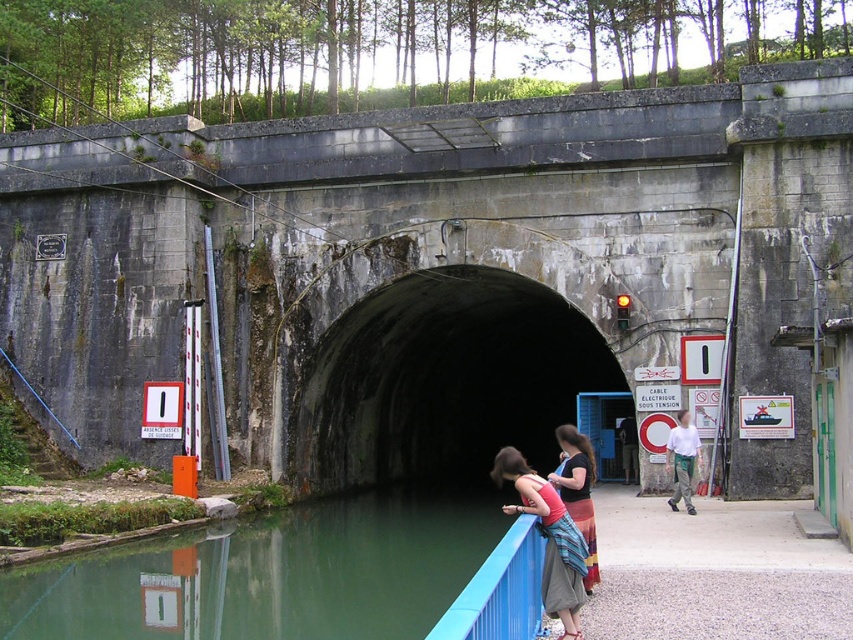
You are a tour guide leading a group near the canal and the tunnel. You need to inform them about the width of the green smooth water at lower left and the dark concrete tunnel at center. Which one is narrower?

The green smooth water at lower left is narrower than the dark concrete tunnel at center.

You are a delivery drone carrying a package and need to fly from the green smooth water at lower left to the dark concrete tunnel at center. What is the minimum horizontal distance you need to cover?

The minimum horizontal distance between the green smooth water at lower left and the dark concrete tunnel at center is 14.26 meters, so the drone needs to cover at least that distance.